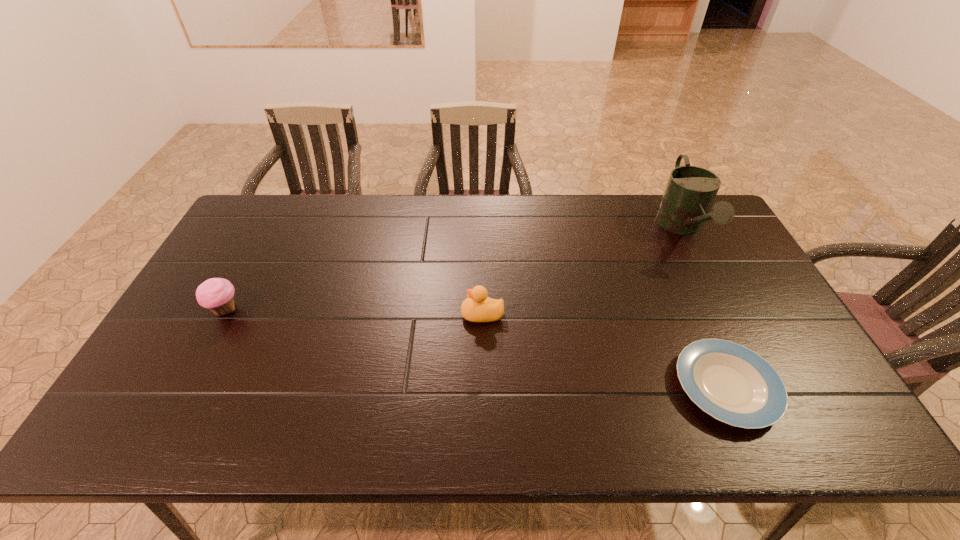
At what (x,y) coordinates should I click in order to perform the action: click on watering can. Please return your answer as a coordinate pair (x, y). Looking at the image, I should click on (689, 194).

The image size is (960, 540). Identify the location of the farthest object. (689, 194).

The height and width of the screenshot is (540, 960). I want to click on the leftmost object, so click(x=217, y=294).

I want to click on duck, so click(x=478, y=307).

At what (x,y) coordinates should I click in order to perform the action: click on the shortest object. Please return your answer as a coordinate pair (x, y). Looking at the image, I should click on coord(733,384).

Identify the location of plate. (733, 384).

Identify the location of free space located 0.060m with the spout on the tallest object. (709, 282).

What are the coordinates of `blank space located 0.310m on the right of the leftmost object` in the screenshot? It's located at (353, 310).

Where is `vacant point located 0.380m on the face of the third object from right to left`? Image resolution: width=960 pixels, height=540 pixels. vacant point located 0.380m on the face of the third object from right to left is located at coordinates (324, 314).

Where is `free spot located on the face of the third object from right to left`? Image resolution: width=960 pixels, height=540 pixels. free spot located on the face of the third object from right to left is located at coordinates (425, 314).